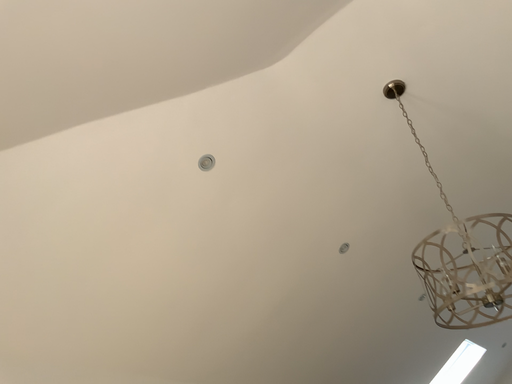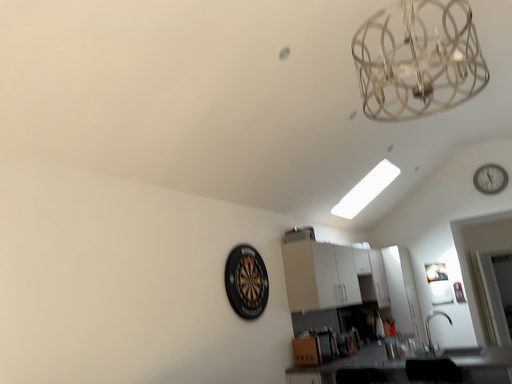
Question: How did the camera likely rotate when shooting the video?

Choices:
 (A) rotated downward
 (B) rotated upward

Answer: (A)